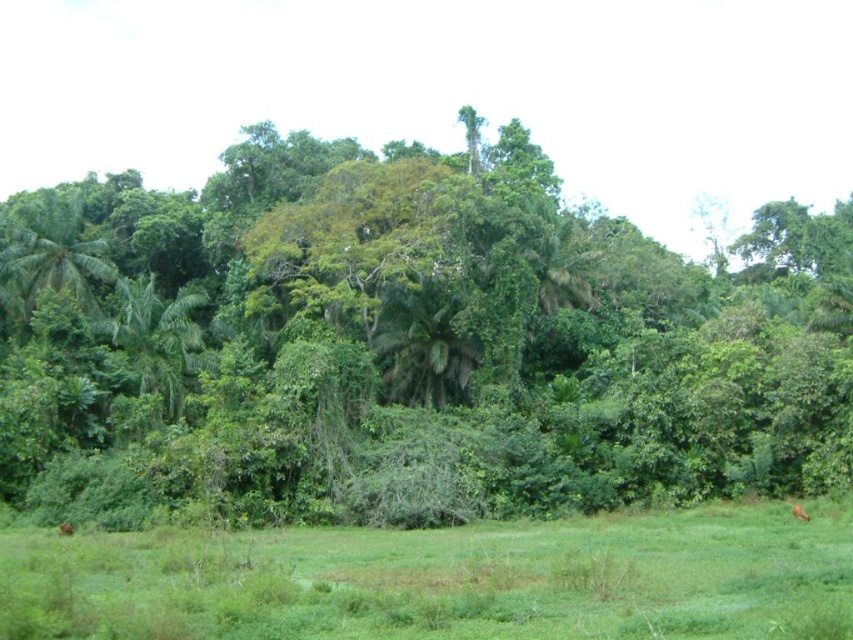
You are a hiker standing in the green grassy field at lower center. You want to reach the edge of the forest. Which direction should you move to avoid the green leafy tree at center?

To avoid the green leafy tree at center, you should move towards the edge of the forest in a direction away from the tree. Since the green leafy tree at center is much taller than the green grassy field at lower center, moving sideways around it would be safer. The best path would be to go either to the left or right of the tree, staying within the green grassy field at lower center until you reach the forest edge.

You are a hiker trying to navigate through the tropical forest. You see the green leafy tree at center and the green grassy field at lower center. Which object would you consider as the bigger one in terms of size?

The green leafy tree at center is larger in size compared to the green grassy field at lower center, so the green leafy tree at center is the bigger one.

You are standing in the tropical forest and want to reach the green grassy field at lower center. Which direction should you walk relative to the green leafy tree at center?

You should walk to the left of the green leafy tree at center to reach the green grassy field at lower center, since the tree is positioned to the right of the field.